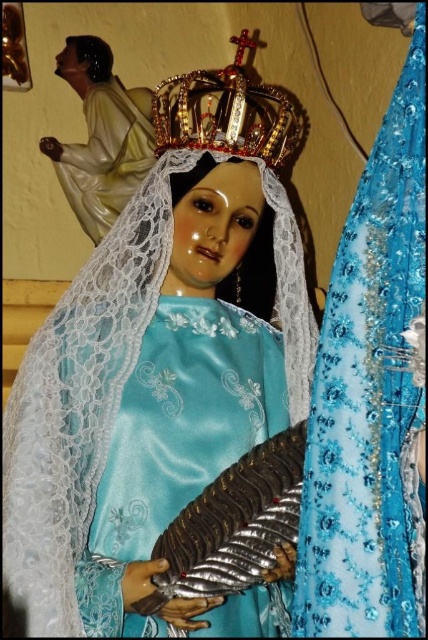
Question: Can you confirm if satin blue dress at center is positioned above gold jeweled crown at upper center?

Choices:
 (A) no
 (B) yes

Answer: (A)

Question: Is satin blue dress at center in front of matte white statue at upper left?

Choices:
 (A) yes
 (B) no

Answer: (A)

Question: Which object is closer to the camera taking this photo?

Choices:
 (A) matte white statue at upper left
 (B) satin blue dress at center

Answer: (B)

Question: Which of the following is the closest to the observer?

Choices:
 (A) matte white statue at upper left
 (B) satin blue dress at center
 (C) gold jeweled crown at upper center

Answer: (B)

Question: Is satin blue dress at center to the right of matte white statue at upper left from the viewer's perspective?

Choices:
 (A) no
 (B) yes

Answer: (B)

Question: Which of the following is the farthest from the observer?

Choices:
 (A) satin blue dress at center
 (B) matte white statue at upper left

Answer: (B)